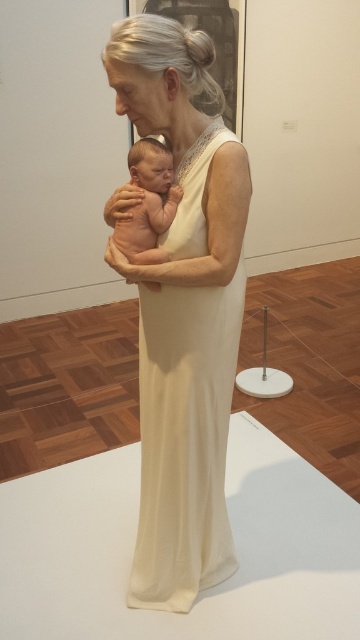
Question: Does white silk dress at center have a smaller size compared to smooth skin baby at center?

Choices:
 (A) yes
 (B) no

Answer: (B)

Question: Is white silk dress at center smaller than smooth skin baby at center?

Choices:
 (A) no
 (B) yes

Answer: (A)

Question: Which object is closer to the camera taking this photo?

Choices:
 (A) white silk dress at center
 (B) smooth skin baby at center

Answer: (A)

Question: Does white silk dress at center appear on the right side of smooth skin baby at center?

Choices:
 (A) no
 (B) yes

Answer: (B)